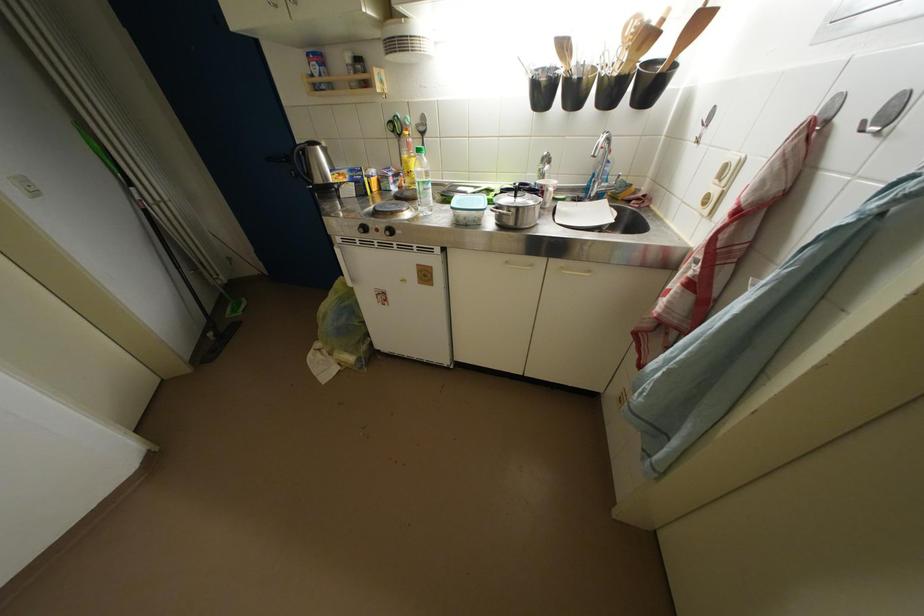
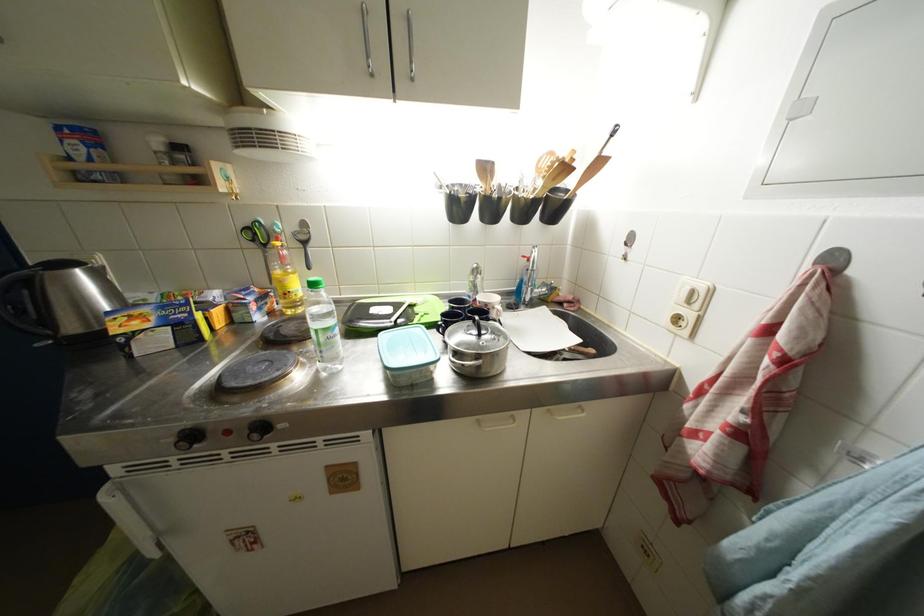
Locate, in the second image, the point that corresponds to [570,50] in the first image.

(492, 172)